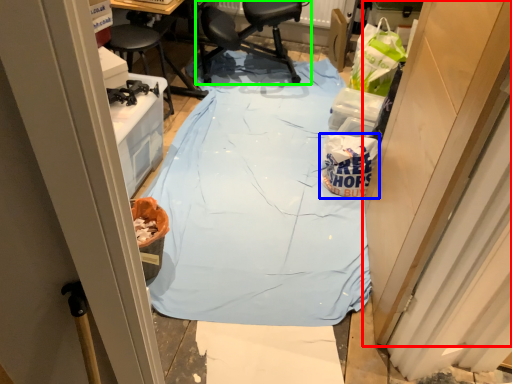
Question: Which is farther away from door (highlighted by a red box)? waste (highlighted by a blue box) or chair (highlighted by a green box)?

Choices:
 (A) waste
 (B) chair

Answer: (B)